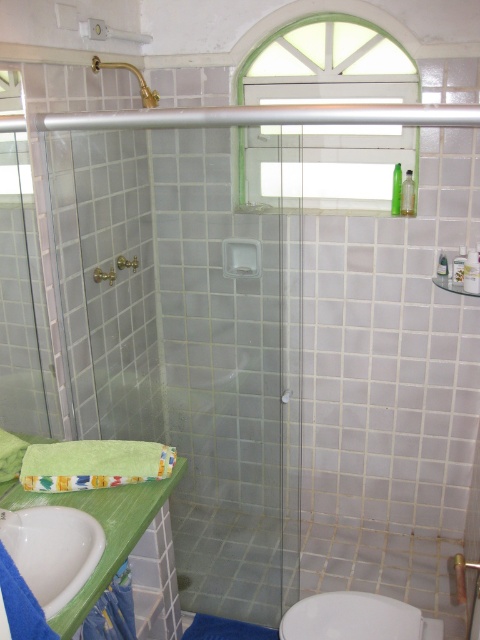
Looking at this image, you are a bathroom designer planning to install a new shelf between the white glossy toilet bowl at lower right and the gold metallic faucet at upper left. Which object should the shelf be placed closer to if it needs to be wider than both objects?

The shelf should be placed closer to the white glossy toilet bowl at lower right since it might be wider than the gold metallic faucet at upper left, so the shelf needs to accommodate the wider object.

You are standing in the bathroom and want to reach the point marked at coordinates (x=91, y=518). If your arm can extend 1.4 meters, will you be able to touch that point without moving closer?

The point at (x=91, y=518) is 1.53 meters away from you. Since your arm can only extend 1.4 meters, you cannot reach it without moving closer.